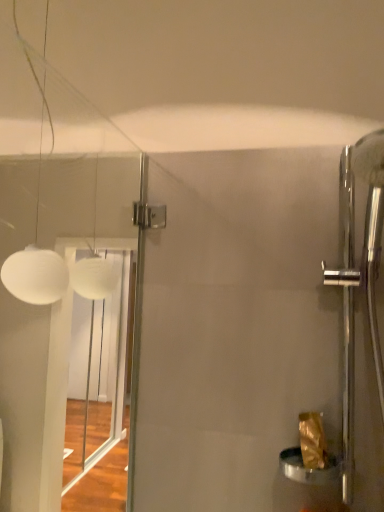
What do you see at coordinates (36, 248) in the screenshot?
I see `white matte lamp at upper left` at bounding box center [36, 248].

Looking at this image, measure the distance between point [33,288] and camera.

A distance of 32.60 inches exists between point [33,288] and camera.

Locate an element on the screen. The image size is (384, 512). white matte lamp at upper left is located at coordinates (36, 248).

Where is `white matte lamp at upper left`? white matte lamp at upper left is located at coordinates click(x=36, y=248).